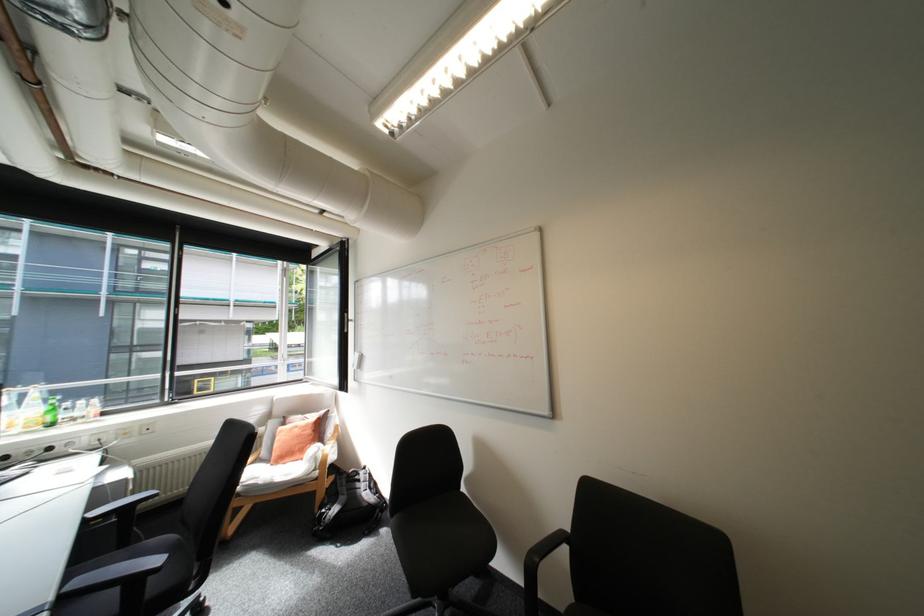
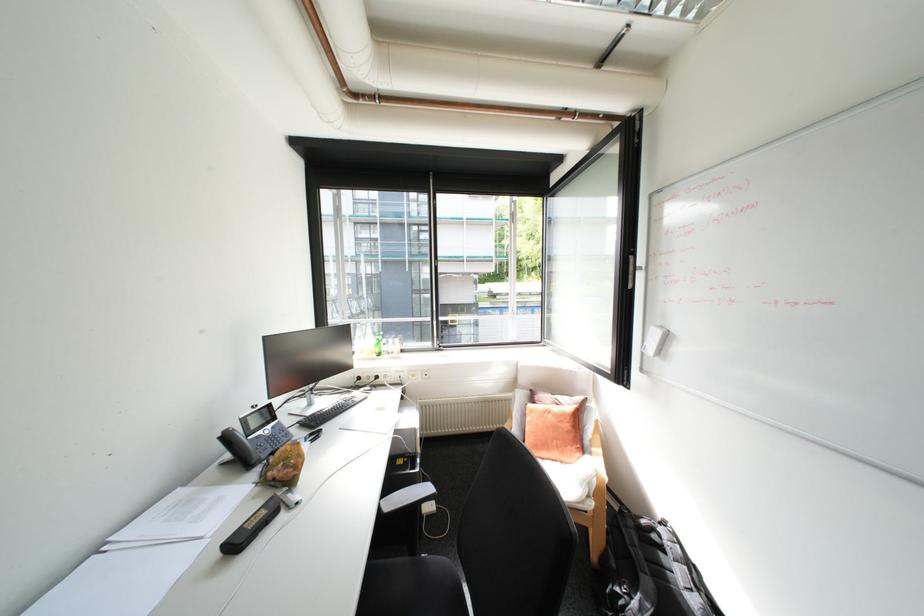
Find the pixel in the second image that matches (307,429) in the first image.

(561, 416)